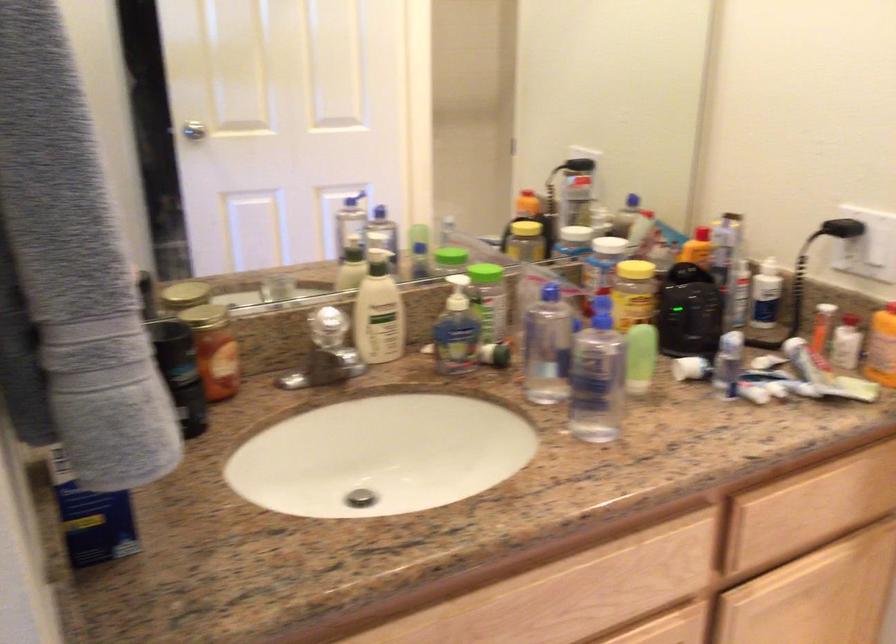
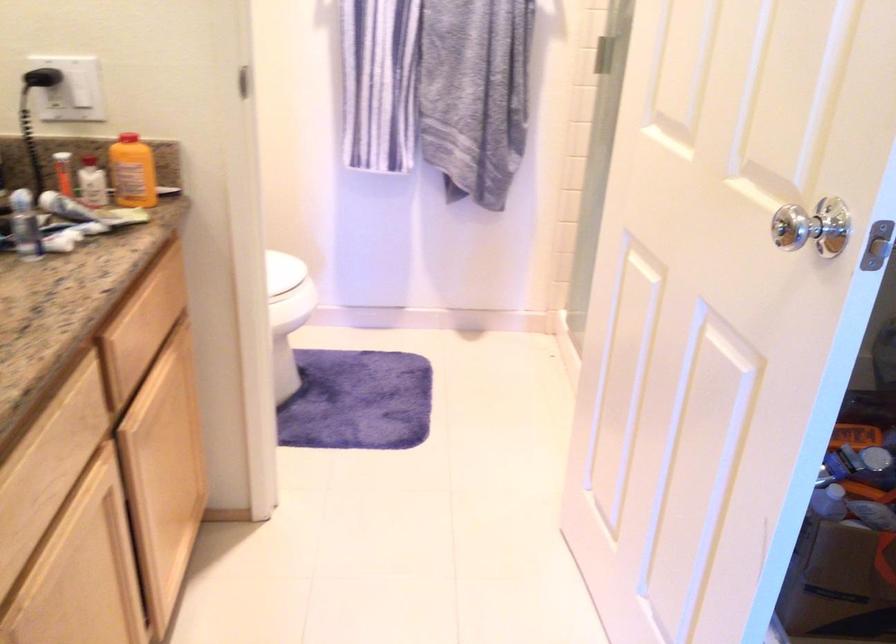
Where in the second image is the point corresponding to the point at 798,368 from the first image?

(89, 211)